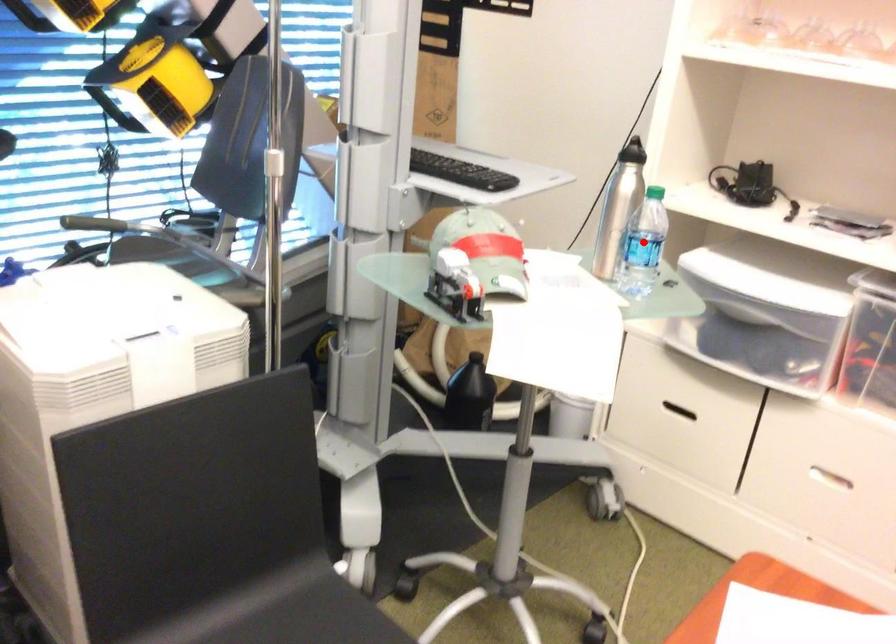
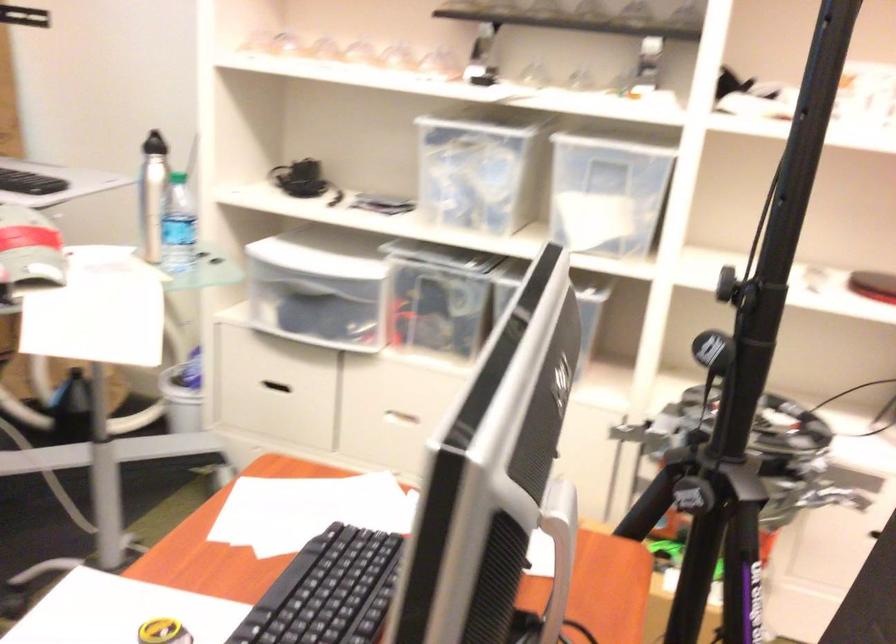
Question: I am providing you with two images of the same scene from different viewpoints. A red point is marked on the first image. At the location where the point appears in image 1, is it still visible in image 2?

Choices:
 (A) Yes
 (B) No

Answer: (A)